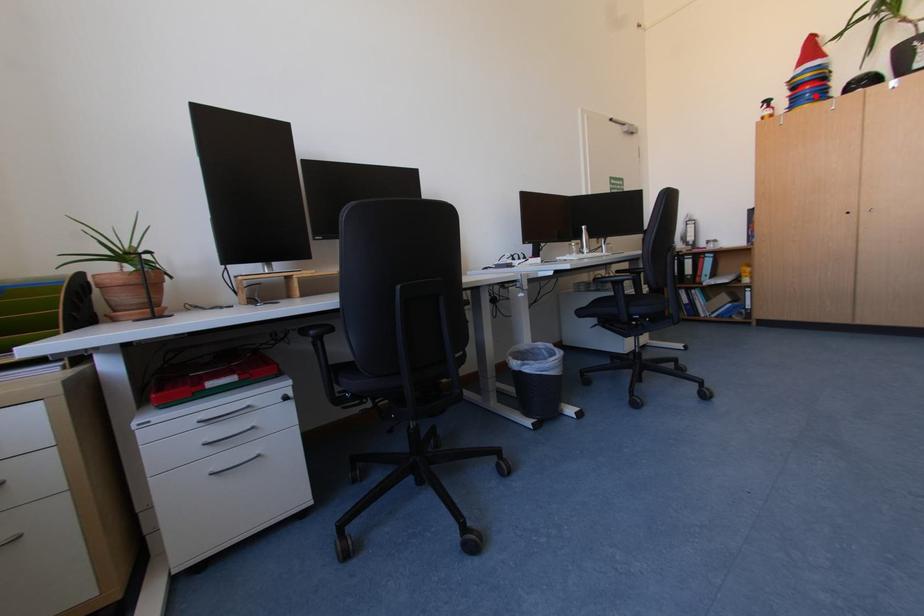
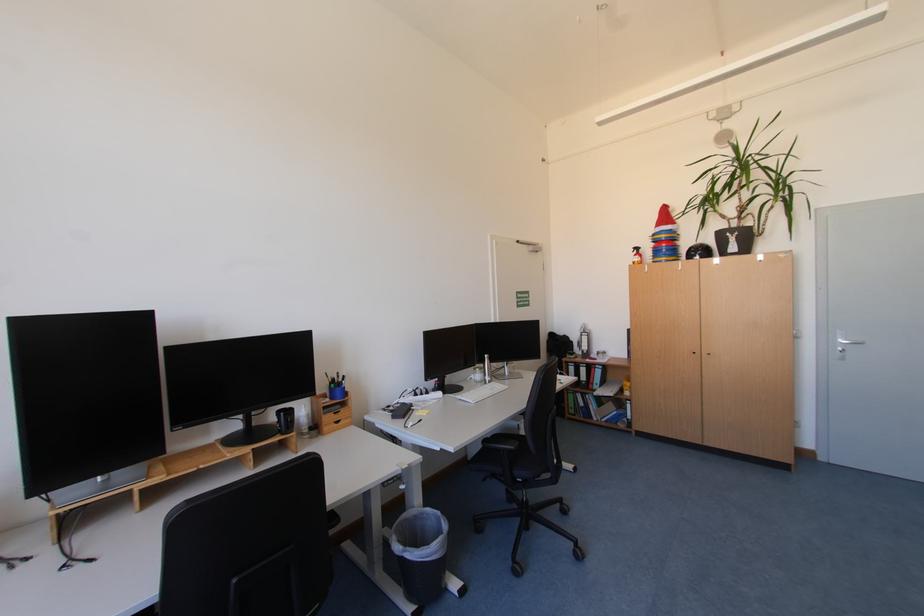
Question: I am providing you with two images of the same scene from different viewpoints. A red point is marked on the first image. Is the red point's position out of view in image 2?

Choices:
 (A) Yes
 (B) No

Answer: (B)